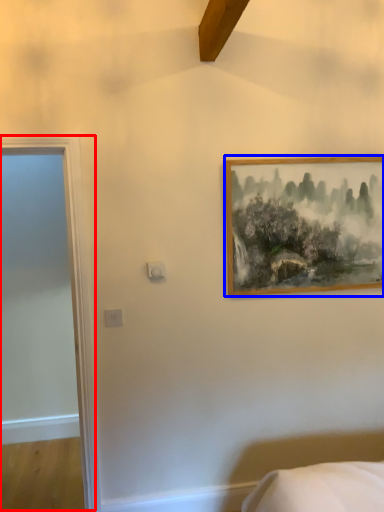
Question: Which of the following is the farthest to the observer, door (highlighted by a red box) or picture frame (highlighted by a blue box)?

Choices:
 (A) door
 (B) picture frame

Answer: (B)